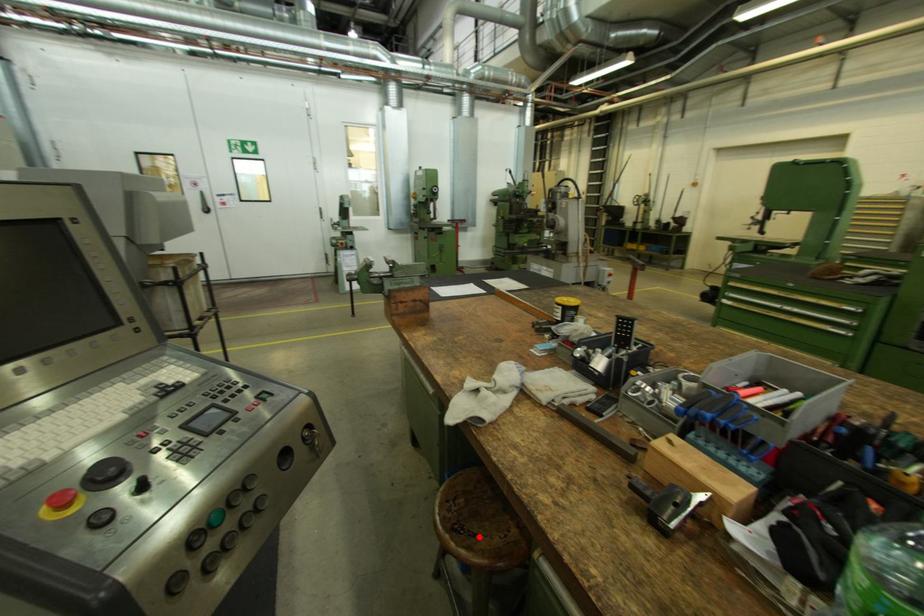
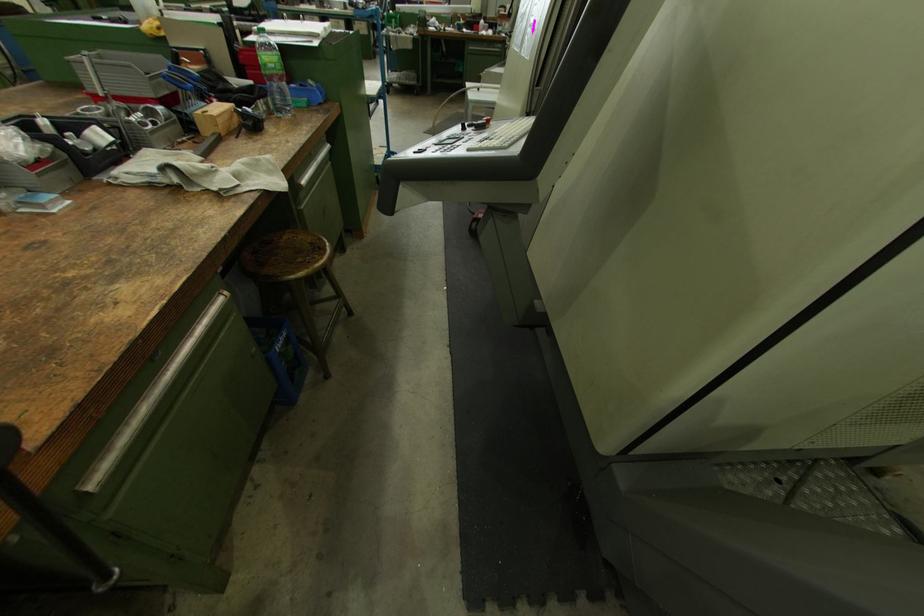
The point at the highlighted location is marked in the first image. Where is the corresponding point in the second image?

(317, 244)